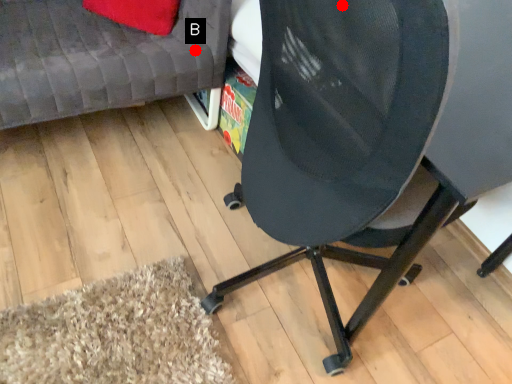
Question: Two points are circled on the image, labeled by A and B beside each circle. Which point is closer to the camera?

Choices:
 (A) A is closer
 (B) B is closer

Answer: (A)